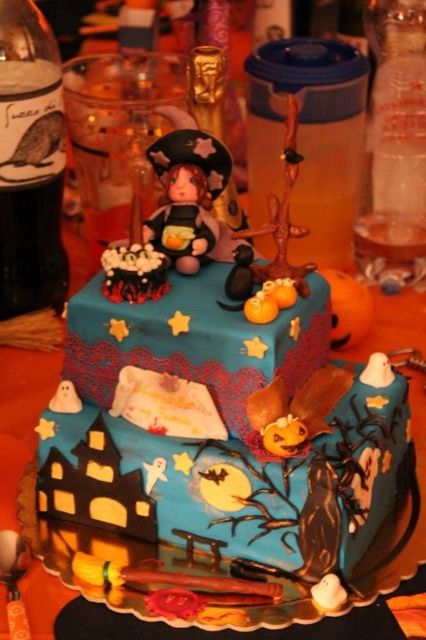
You are a guest at a Halloween party and see the Halloween cake on the table. There is also a translucent glass bottle at left. From the perspective of someone standing directly in front of the cake, which object is positioned to the left side of the cake?

The translucent glass bottle at left is positioned to the left side of the cake.

You are a customer at a Halloween party and you want to take a photo of the cake. You notice two points on the cake, point (48, 224) and point (198, 156). If you want to ensure both points are visible in your photo without any obstruction, which point should you position closer to the camera?

Point (198, 156) should be positioned closer to the camera because point (48, 224) is behind it, so moving the camera closer to point (198, 156) will keep both points visible without obstruction.

You are a guest at a Halloween party and see the two items on the cake table. The translucent glass bottle at left and the matte plastic witch at center. Which item is bigger?

The translucent glass bottle at left is larger in size compared to the matte plastic witch at center.